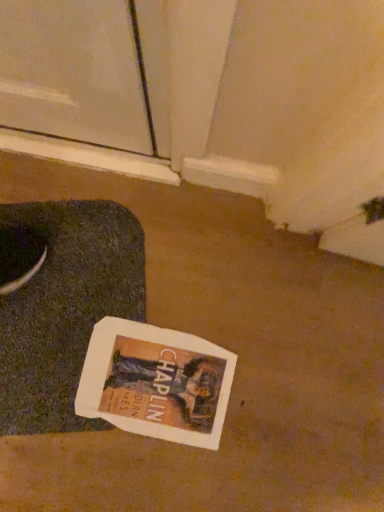
Find the location of a particular element. This screenshot has width=384, height=512. free spot to the left of white paper magazine at center is located at coordinates (55, 333).